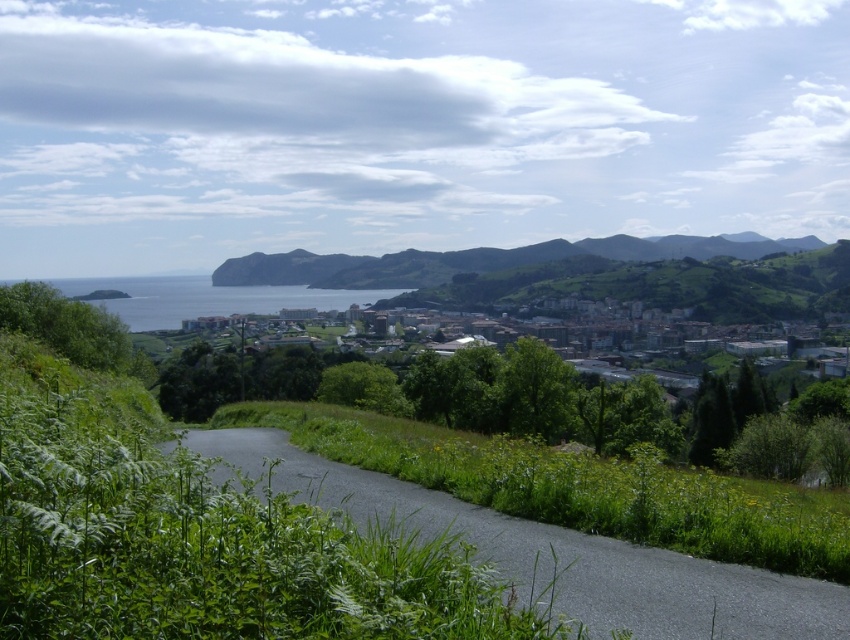
You are a hiker standing at the start of the asphalt road at center. You want to reach the brown stone buildings at center. Which direction should you walk to get there?

The asphalt road at center is in front of the brown stone buildings at center, so you should walk forward along the asphalt road at center towards the brown stone buildings at center.

You are driving along the asphalt road at center and want to reach the brown stone buildings at center. According to the scene description, which direction should you turn to head towards them?

The asphalt road at center is to the left of brown stone buildings at center, so you should turn to the right to head towards the brown stone buildings at center.

Based on the photo, you are a hiker standing at the start of the asphalt road at center. You want to reach the brown stone buildings at center. Which direction should you walk to get there?

The asphalt road at center leads towards the brown stone buildings at center, so you should walk forward along the asphalt road at center to reach them.